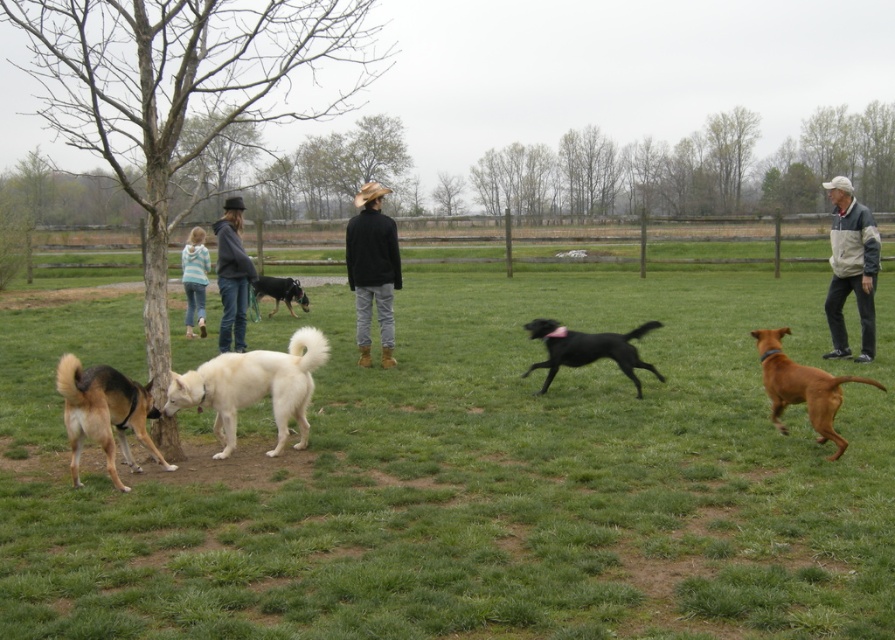
You are a photographer trying to capture a clear photo of the black matte jacket at center and the shiny black dog at center. Since both are black, you need to adjust your camera settings to account for their sizes. Which object should you focus on first if you want to ensure both are in focus, considering their relative sizes?

The black matte jacket at center is thinner than the shiny black dog at center, so you should focus on the shiny black dog at center first because larger objects require more precise focusing to ensure all parts are sharp.

You are a photographer setting up a tripod in the park. You need to place the tripod so that it doesn not block the view of both the black matte jacket at center and the shiny black dog at center. Given their sizes, which object should you position the tripod closer to?

The black matte jacket at center is larger in size than the shiny black dog at center, so you should position the tripod closer to the shiny black dog at center to avoid blocking the view of the larger jacket.

You are standing in the park and want to place a small bench between the two points labeled point (84, 420) and point (235, 260). Which point should the bench be closer to so that it is nearer to the viewer?

The bench should be placed closer to point (84, 420) because it is closer to the viewer than point (235, 260).